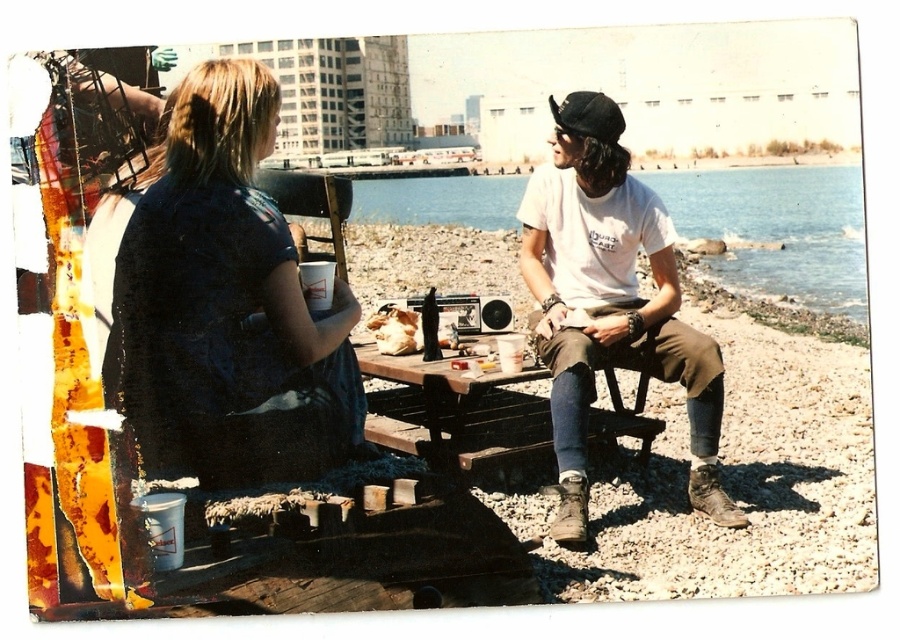
Does white cotton t-shirt at center have a lesser height compared to blue water at center?

Yes.

Between white cotton t-shirt at center and blue water at center, which one is positioned lower?

white cotton t-shirt at center is lower down.

Identify the location of white cotton t-shirt at center. (610, 301).

Which is in front, point (130, 317) or point (540, 209)?

Positioned in front is point (130, 317).

Is matte blue shirt at center to the left of white cotton t-shirt at center from the viewer's perspective?

Yes, matte blue shirt at center is to the left of white cotton t-shirt at center.

Locate an element on the screen. matte blue shirt at center is located at coordinates (226, 305).

Who is taller, blue water at center or wooden picnic table at center?

With more height is blue water at center.

Does blue water at center have a larger size compared to wooden picnic table at center?

Correct, blue water at center is larger in size than wooden picnic table at center.

Find the location of a particular element. blue water at center is located at coordinates (777, 228).

The height and width of the screenshot is (640, 900). What are the coordinates of `blue water at center` in the screenshot? It's located at (777, 228).